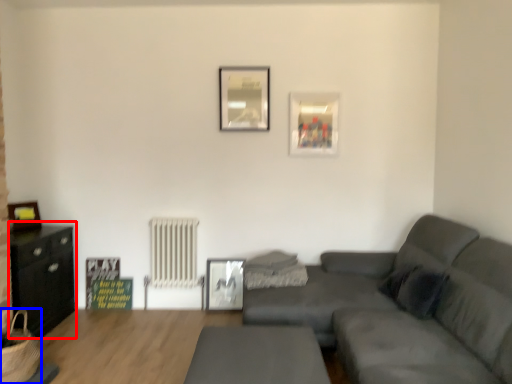
Question: Which object is further to the camera taking this photo, entertainment center (highlighted by a red box) or basket (highlighted by a blue box)?

Choices:
 (A) entertainment center
 (B) basket

Answer: (A)